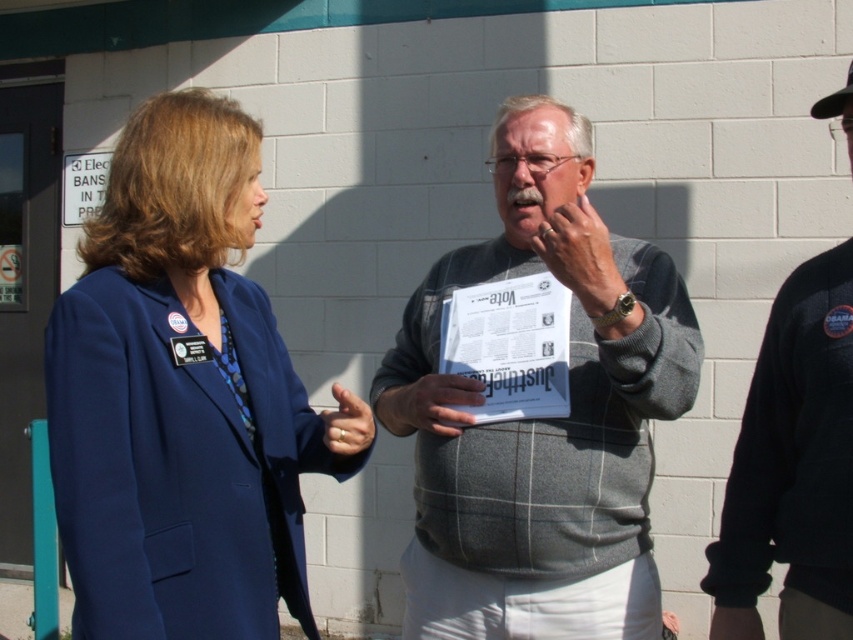
Question: Based on their relative distances, which object is farther from the black fleece jacket at right?

Choices:
 (A) blue fabric jacket at center
 (B) gray plaid sweater at center

Answer: (A)

Question: Can you confirm if blue fabric jacket at center is wider than gray plaid sweater at center?

Choices:
 (A) no
 (B) yes

Answer: (A)

Question: Where is gray plaid sweater at center located in relation to black fleece jacket at right in the image?

Choices:
 (A) left
 (B) right

Answer: (A)

Question: Is blue fabric jacket at center smaller than gray plaid sweater at center?

Choices:
 (A) yes
 (B) no

Answer: (A)

Question: Which of these objects is positioned farthest from the blue fabric jacket at center?

Choices:
 (A) gray plaid sweater at center
 (B) black fleece jacket at right

Answer: (B)

Question: Which is nearer to the blue fabric jacket at center?

Choices:
 (A) black fleece jacket at right
 (B) gray plaid sweater at center

Answer: (B)